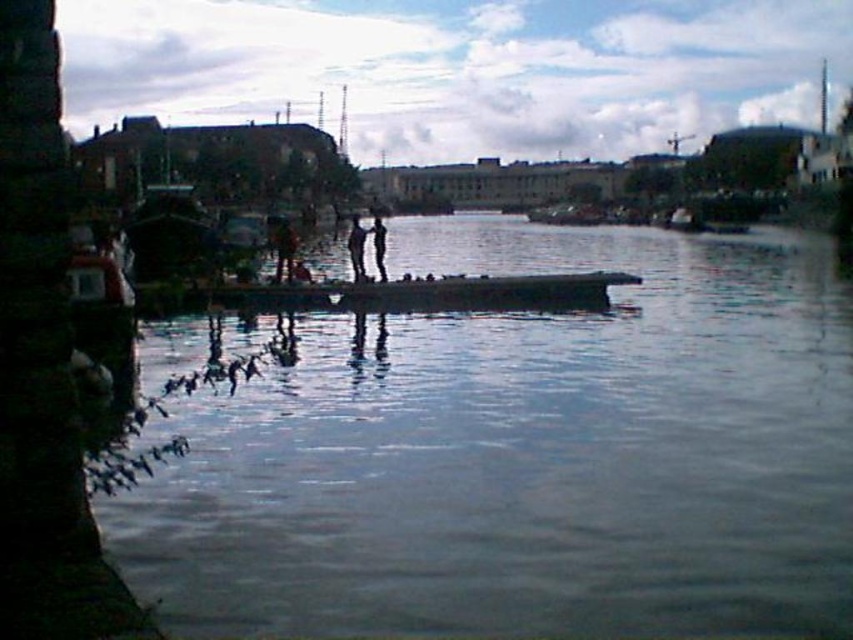
You are standing at the point with coordinates point (357, 248) in the riverside scene. What object or feature is located exactly at this point?

The point (357, 248) corresponds to the smooth black figure at center.

You are standing on the riverside and see the smooth concrete dock at center and the black matte person at center. Which object is positioned to the right of the other?

The smooth concrete dock at center is to the right of the black matte person at center.